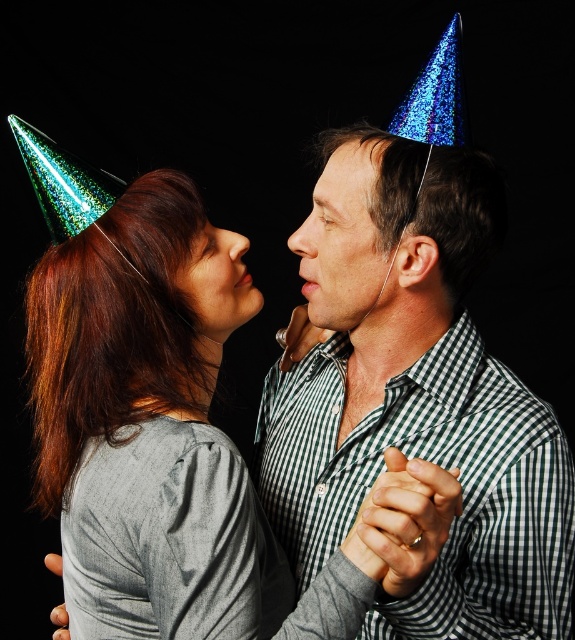
Does point (365, 465) lie behind point (346, 138)?

No, it is in front of (346, 138).

Is shiny blue party hat at center bigger than shiny metallic forehead at center?

Correct, shiny blue party hat at center is larger in size than shiny metallic forehead at center.

Is point (419, 416) positioned after point (358, 140)?

Yes, it is.

Image resolution: width=575 pixels, height=640 pixels. What are the coordinates of `shiny blue party hat at center` in the screenshot? It's located at (417, 404).

Between shiny blue party hat at center and matte green party hat at center, which one has more height?

shiny blue party hat at center

Identify the location of shiny blue party hat at center. (417, 404).

Where is `shiny blue party hat at center`? shiny blue party hat at center is located at coordinates (417, 404).

Is matte green party hat at center to the right of matte skin at center from the viewer's perspective?

Correct, you'll find matte green party hat at center to the right of matte skin at center.

Does matte green party hat at center have a lesser width compared to matte skin at center?

In fact, matte green party hat at center might be wider than matte skin at center.

Between point (347, 177) and point (224, 333), which one is positioned in front?

Point (347, 177) is more forward.

The width and height of the screenshot is (575, 640). What are the coordinates of `matte green party hat at center` in the screenshot? It's located at (348, 248).